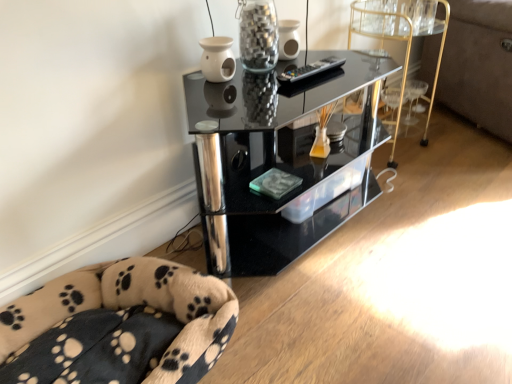
Question: From the image's perspective, is transparent glass jar at upper center beneath velvet beige couch at right?

Choices:
 (A) yes
 (B) no

Answer: (A)

Question: Is transparent glass jar at upper center facing away from velvet beige couch at right?

Choices:
 (A) no
 (B) yes

Answer: (A)

Question: Considering the relative sizes of transparent glass jar at upper center and velvet beige couch at right in the image provided, is transparent glass jar at upper center wider than velvet beige couch at right?

Choices:
 (A) no
 (B) yes

Answer: (A)

Question: Does transparent glass jar at upper center come behind velvet beige couch at right?

Choices:
 (A) no
 (B) yes

Answer: (A)

Question: Is transparent glass jar at upper center touching velvet beige couch at right?

Choices:
 (A) no
 (B) yes

Answer: (A)

Question: From a real-world perspective, is transparent glass jar at upper center below velvet beige couch at right?

Choices:
 (A) yes
 (B) no

Answer: (B)

Question: From the image's perspective, is black glass shelf at center on transparent glass jar at upper center?

Choices:
 (A) no
 (B) yes

Answer: (A)

Question: Does black glass shelf at center contain transparent glass jar at upper center?

Choices:
 (A) no
 (B) yes

Answer: (A)

Question: Is black glass shelf at center positioned far away from transparent glass jar at upper center?

Choices:
 (A) yes
 (B) no

Answer: (B)

Question: From a real-world perspective, is black glass shelf at center located higher than transparent glass jar at upper center?

Choices:
 (A) yes
 (B) no

Answer: (B)

Question: Is the depth of black glass shelf at center greater than that of transparent glass jar at upper center?

Choices:
 (A) no
 (B) yes

Answer: (A)

Question: Could you tell me if black glass shelf at center is turned towards transparent glass jar at upper center?

Choices:
 (A) yes
 (B) no

Answer: (B)

Question: Is fluffy beige dog bed at lower left closer to camera compared to transparent glass jar at upper center?

Choices:
 (A) yes
 (B) no

Answer: (A)